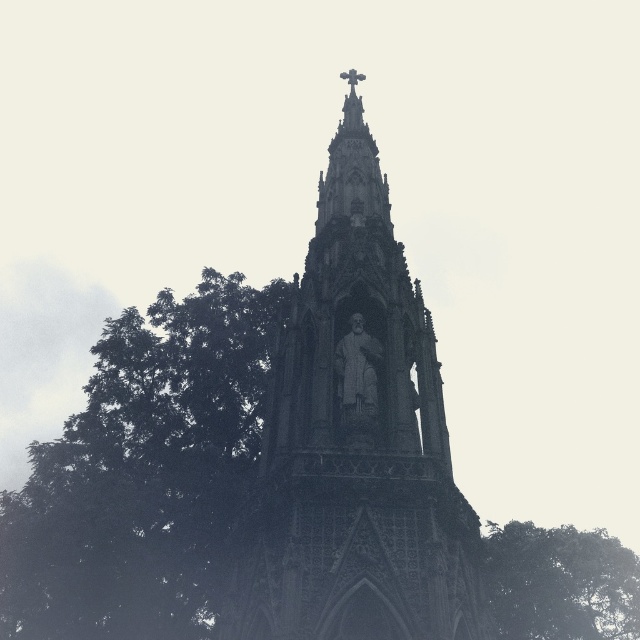
Which is behind, point (328, 179) or point (202, 428)?

The point (328, 179) is more distant.

Is stone statue at center positioned in front of green leafy tree at left?

Yes, stone statue at center is closer to the viewer.

Locate an element on the screen. This screenshot has width=640, height=640. stone statue at center is located at coordinates (356, 442).

From the picture: Which is more to the left, stone statue at center or green leafy tree at lower right?

Positioned to the left is stone statue at center.

Is point (256, 516) positioned in front of point (608, 630)?

Yes, point (256, 516) is in front of point (608, 630).

Identify the location of stone statue at center. (356, 442).

Can you confirm if green leafy tree at left is positioned to the right of green leafy tree at lower right?

Incorrect, green leafy tree at left is not on the right side of green leafy tree at lower right.

Between green leafy tree at left and green leafy tree at lower right, which one is positioned higher?

green leafy tree at left is above.

What do you see at coordinates (145, 474) in the screenshot? The height and width of the screenshot is (640, 640). I see `green leafy tree at left` at bounding box center [145, 474].

Find the location of a particular element. The image size is (640, 640). green leafy tree at left is located at coordinates (145, 474).